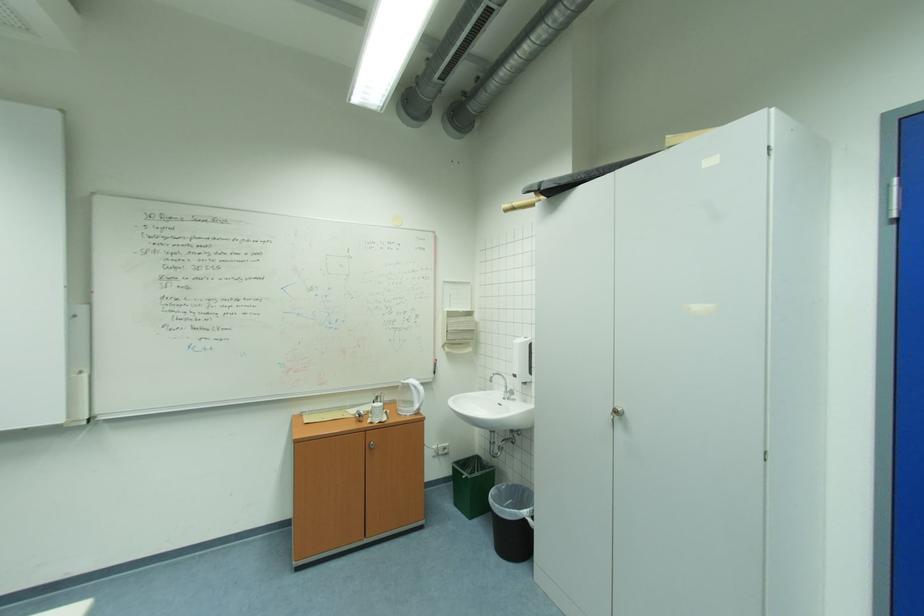
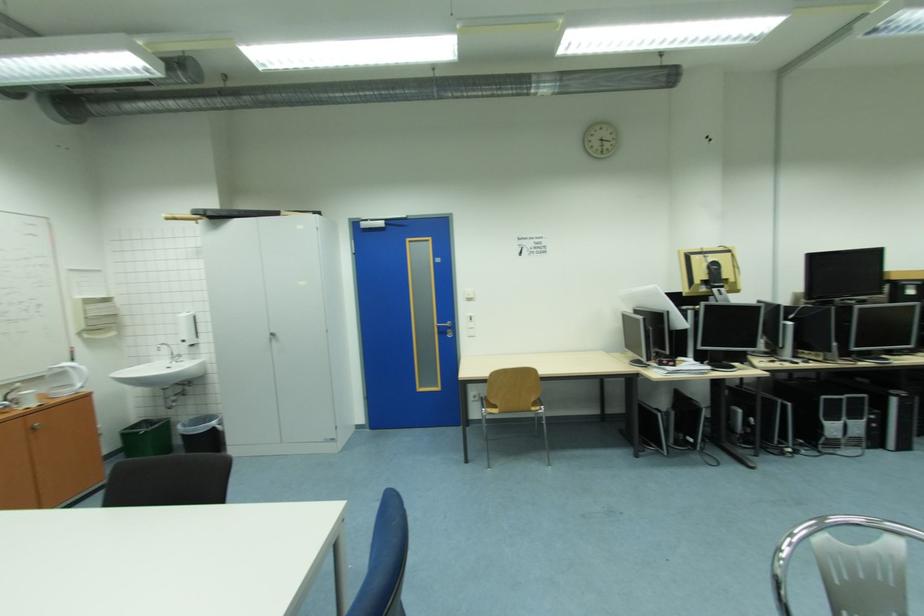
Find the pixel in the second image that matches the point at 507,378 in the first image.

(171, 347)